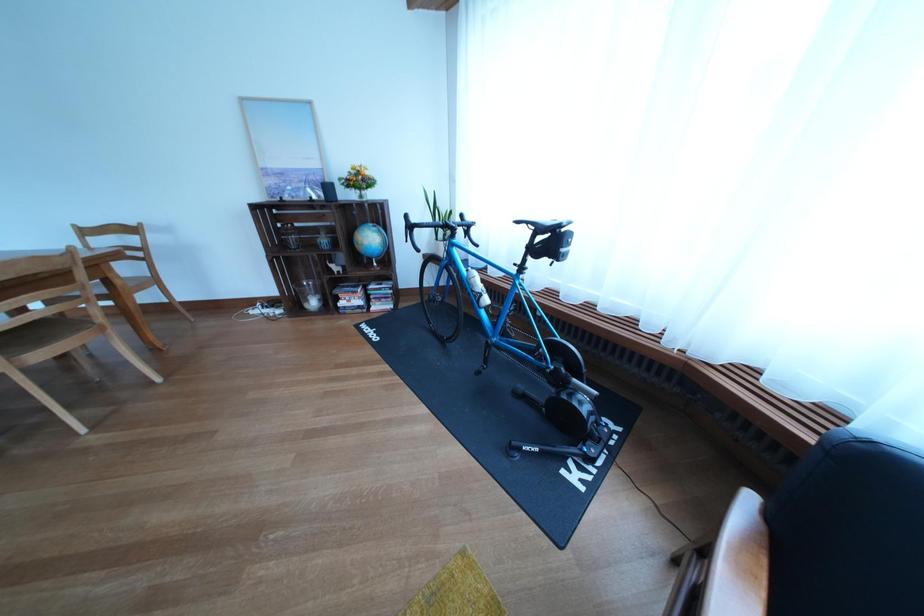
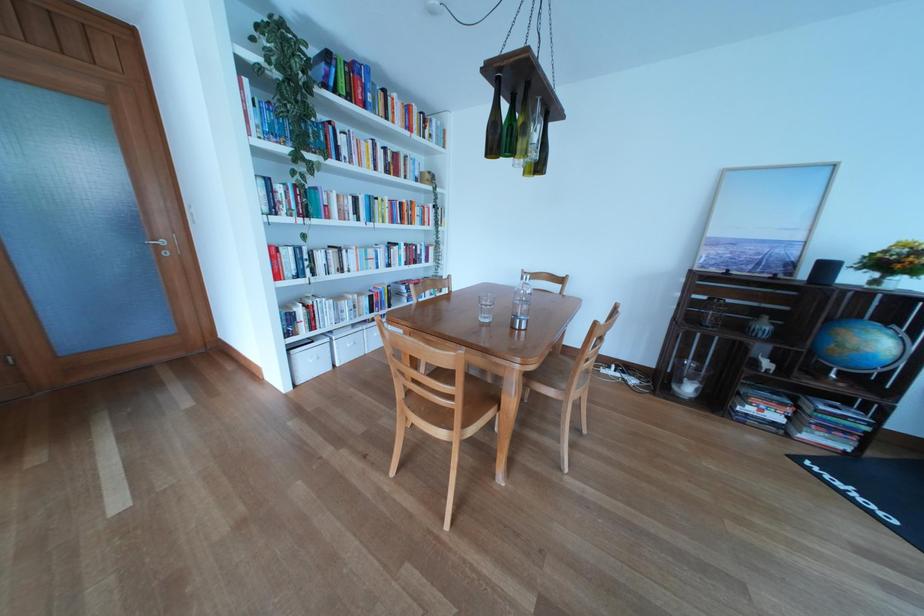
Where in the second image is the point corresponding to point 321,306 from the first image?

(694, 389)